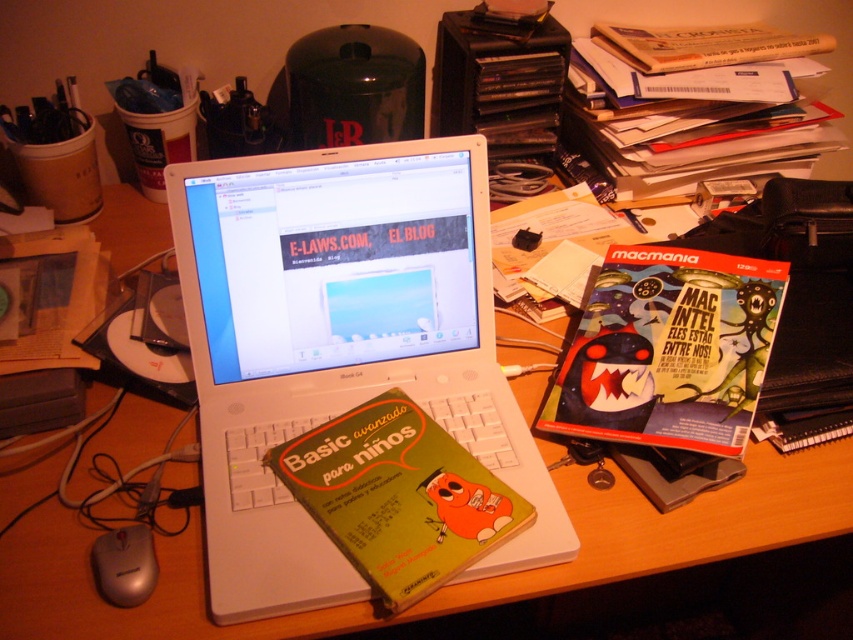
Who is shorter, matte plastic comic book at right or hardcover book at upper right?

Standing shorter between the two is matte plastic comic book at right.

Is matte plastic comic book at right below hardcover book at upper right?

Yes.

Where is `matte plastic comic book at right`? matte plastic comic book at right is located at coordinates 669,349.

Describe the element at coordinates (339, 346) in the screenshot. I see `white plastic laptop at center` at that location.

Can you confirm if white plastic laptop at center is shorter than wooden at center?

No.

The height and width of the screenshot is (640, 853). Identify the location of white plastic laptop at center. (339, 346).

Is white plastic laptop at center to the left of hardcover book at upper right from the viewer's perspective?

Indeed, white plastic laptop at center is positioned on the left side of hardcover book at upper right.

Who is shorter, white plastic laptop at center or hardcover book at upper right?

hardcover book at upper right is shorter.

Identify the location of white plastic laptop at center. The width and height of the screenshot is (853, 640). (339, 346).